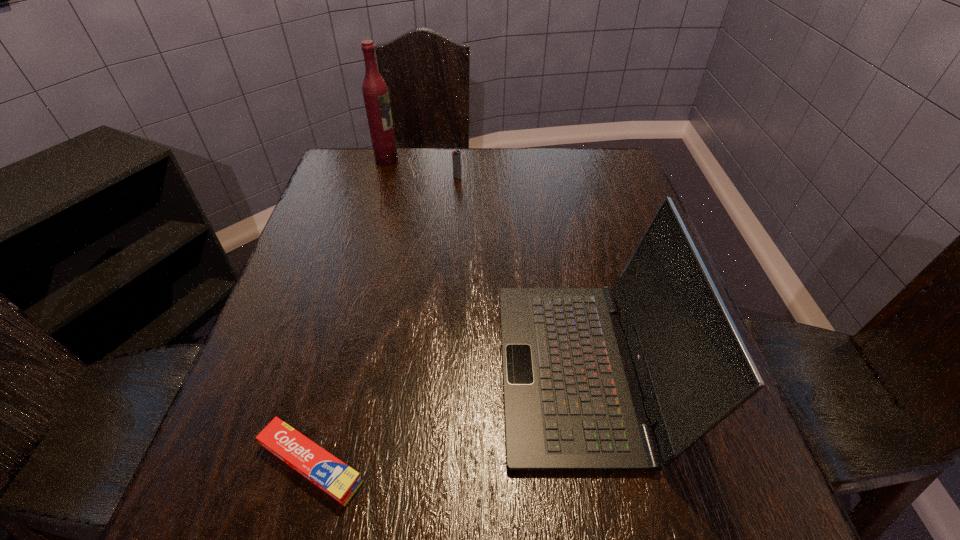
The height and width of the screenshot is (540, 960). Identify the location of free spot located on the screen of the laptop computer. (420, 369).

At what (x,y) coordinates should I click in order to perform the action: click on vacant space situated on the back of the third object from left to right. Please return your answer as a coordinate pair (x, y). Image resolution: width=960 pixels, height=540 pixels. Looking at the image, I should click on (459, 155).

Find the location of a particular element. vacant space located on the back of the toothpaste is located at coordinates (336, 368).

You are a GUI agent. You are given a task and a screenshot of the screen. Output one action in this format:
    pyautogui.click(x=<x>, y=<y>)
    Task: Click on the liquor that is positioned at the far edge
    Image resolution: width=960 pixels, height=540 pixels.
    Given the screenshot: What is the action you would take?
    pyautogui.click(x=375, y=92)

You are a GUI agent. You are given a task and a screenshot of the screen. Output one action in this format:
    pyautogui.click(x=<x>, y=<y>)
    Task: Click on the igniter positioned at the far edge
    Image resolution: width=960 pixels, height=540 pixels.
    Given the screenshot: What is the action you would take?
    pyautogui.click(x=456, y=158)

At what (x,y) coordinates should I click in order to perform the action: click on laptop computer that is at the near edge. Please return your answer as a coordinate pair (x, y). This screenshot has height=540, width=960. Looking at the image, I should click on (572, 402).

Image resolution: width=960 pixels, height=540 pixels. I want to click on toothpaste located at the near edge, so click(337, 479).

Identify the location of liquor that is at the left edge. This screenshot has height=540, width=960. (375, 92).

Identify the location of toothpaste at the left edge. (337, 479).

Locate an element on the screen. object present at the right edge is located at coordinates (572, 402).